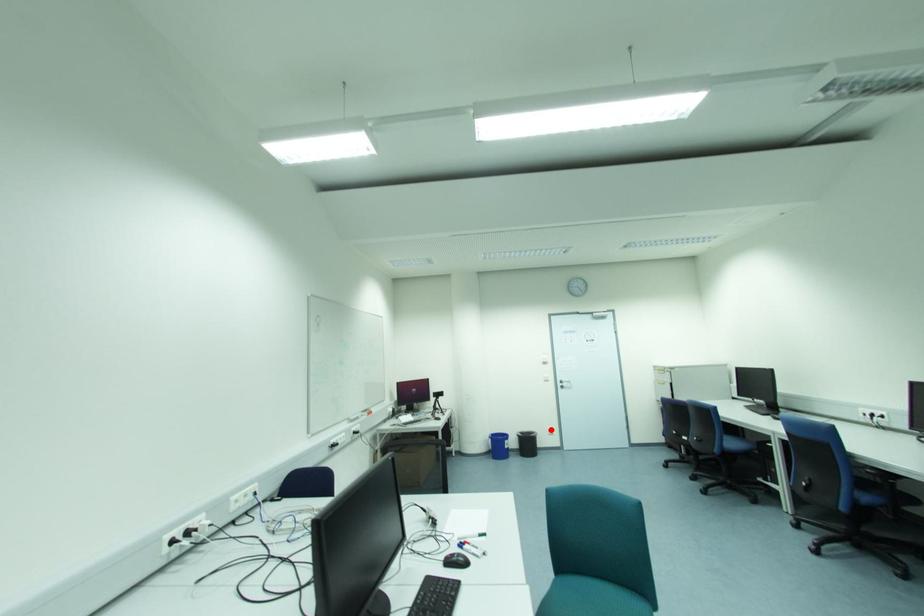
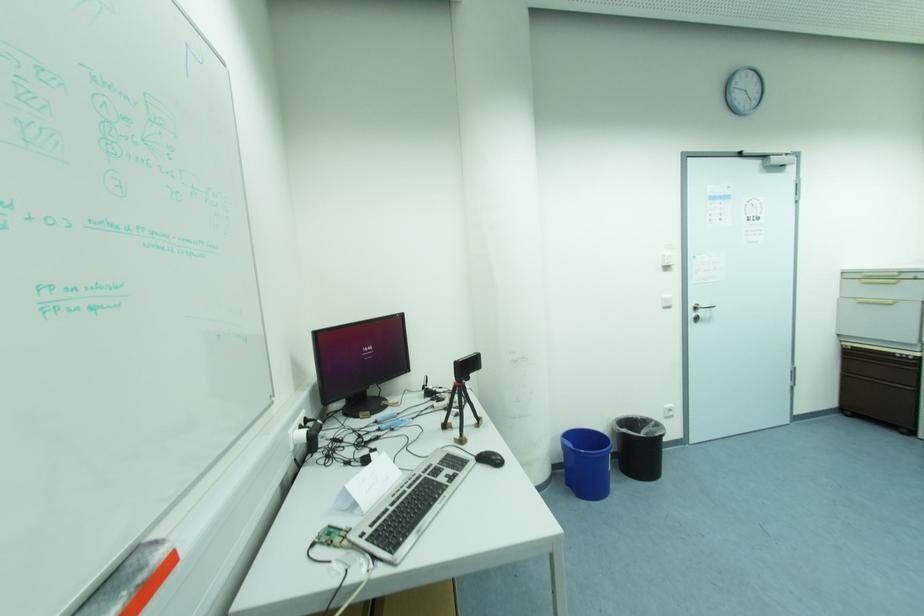
In the second image, find the point that corresponds to the highlighted location in the first image.

(667, 406)